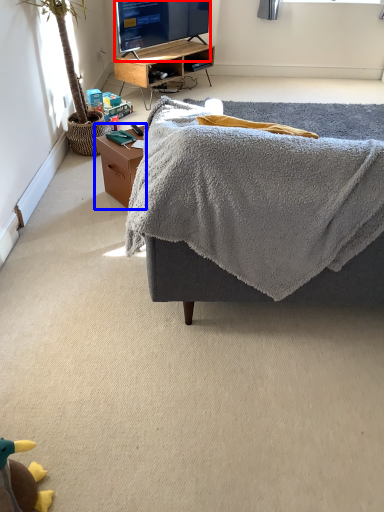
Question: Which of the following is the closest to the observer, television (highlighted by a red box) or table (highlighted by a blue box)?

Choices:
 (A) television
 (B) table

Answer: (B)